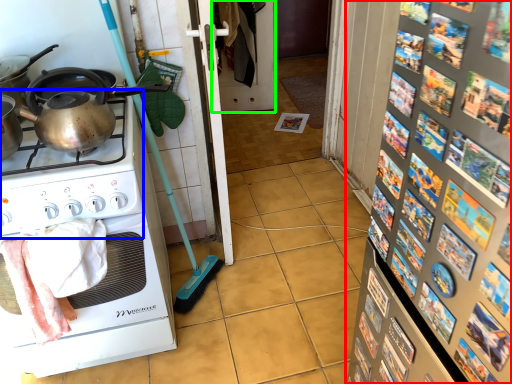
Question: Based on their relative distances, which object is nearer to bulletin board (highlighted by a red box)? Choose from gas stove (highlighted by a blue box) and screen door (highlighted by a green box).

Choices:
 (A) gas stove
 (B) screen door

Answer: (A)